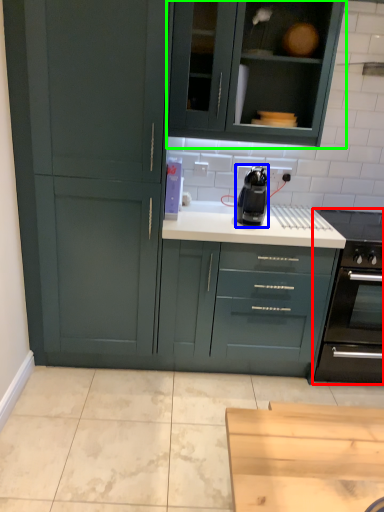
Question: Which is farther away from home appliance (highlighted by a red box)? kitchen appliance (highlighted by a blue box) or cabinetry (highlighted by a green box)?

Choices:
 (A) kitchen appliance
 (B) cabinetry

Answer: (B)